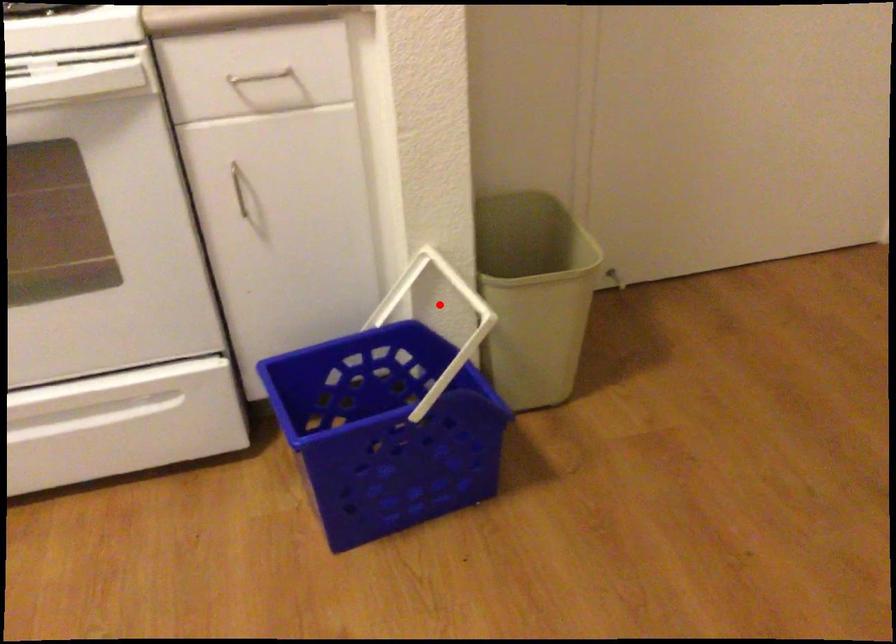
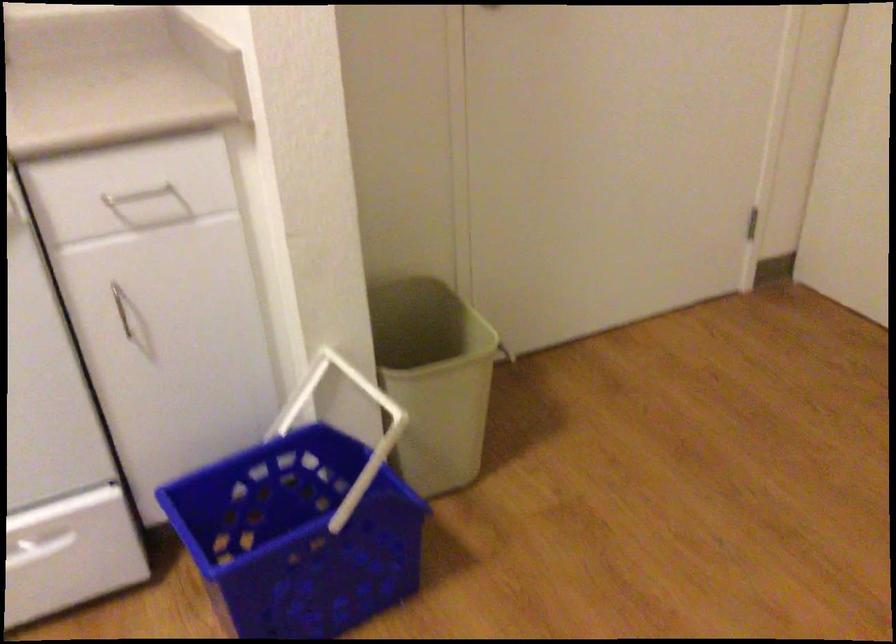
The point at the highlighted location is marked in the first image. Where is the corresponding point in the second image?

(343, 402)